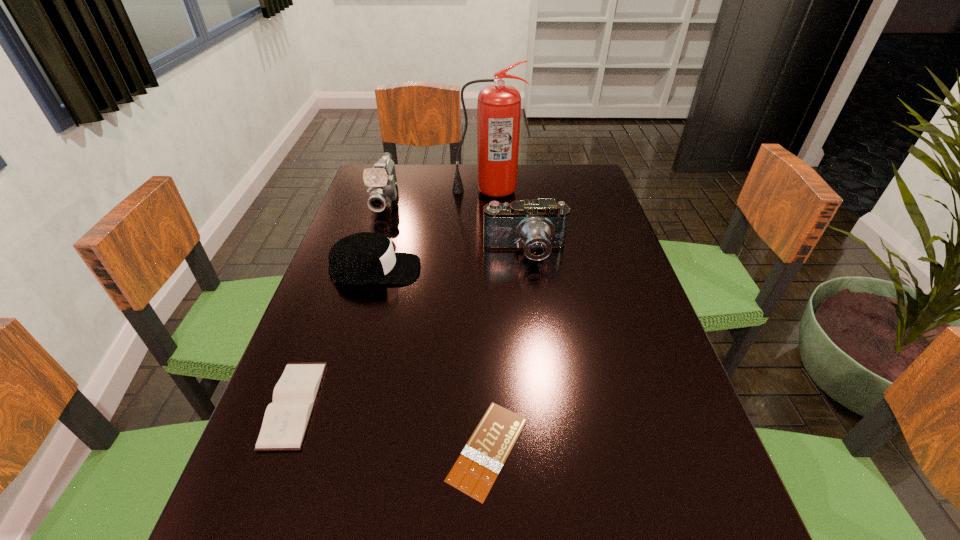
In order to click on the tallest object in this screenshot , I will do [x=499, y=106].

Image resolution: width=960 pixels, height=540 pixels. I want to click on the farther camcorder, so click(x=382, y=180).

Locate an element on the screen. This screenshot has height=540, width=960. the nearer camcorder is located at coordinates (539, 226).

This screenshot has width=960, height=540. What are the coordinates of `the third shortest object` in the screenshot? It's located at (367, 257).

I want to click on diary, so click(x=286, y=419).

You are a GUI agent. You are given a task and a screenshot of the screen. Output one action in this format:
    pyautogui.click(x=<x>, y=<y>)
    Task: Click on the chocolate bar
    The height and width of the screenshot is (540, 960).
    Given the screenshot: What is the action you would take?
    pyautogui.click(x=475, y=471)

The height and width of the screenshot is (540, 960). What are the coordinates of `vacant space situated on the instruction side of the tallest object` in the screenshot? It's located at click(x=489, y=264).

I want to click on free region located on the front-facing side of the farther camcorder, so click(x=355, y=299).

This screenshot has height=540, width=960. I want to click on free space located 0.200m on the front-facing side of the right camcorder, so click(535, 329).

I want to click on free space located 0.250m on the front-facing side of the fourth tallest object, so click(x=521, y=270).